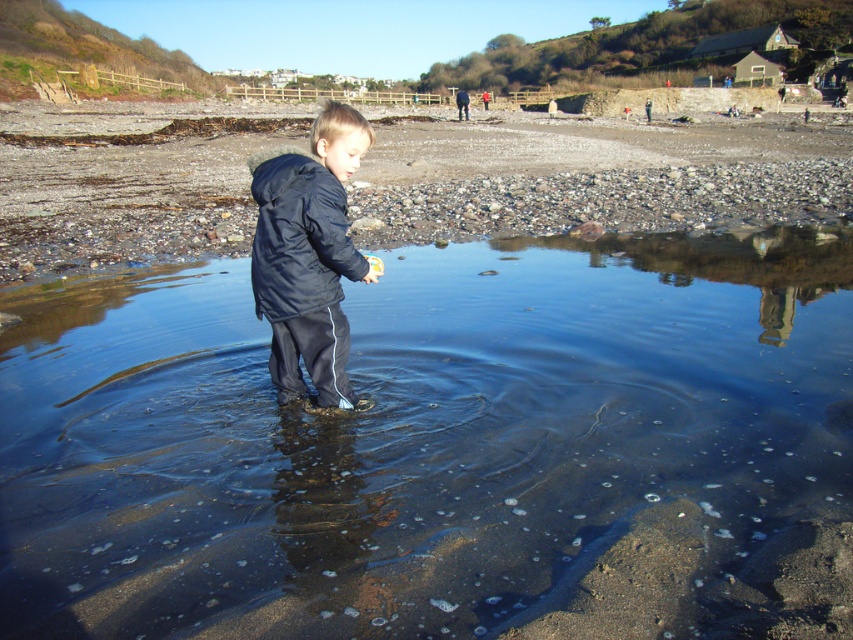
You are a photographer trying to capture a shot of the smooth sand beach at center and the matte black jacket at center. Based on their positions, which object would appear larger in the photo?

The smooth sand beach at center would appear larger in the photo because it is much taller than the matte black jacket at center.